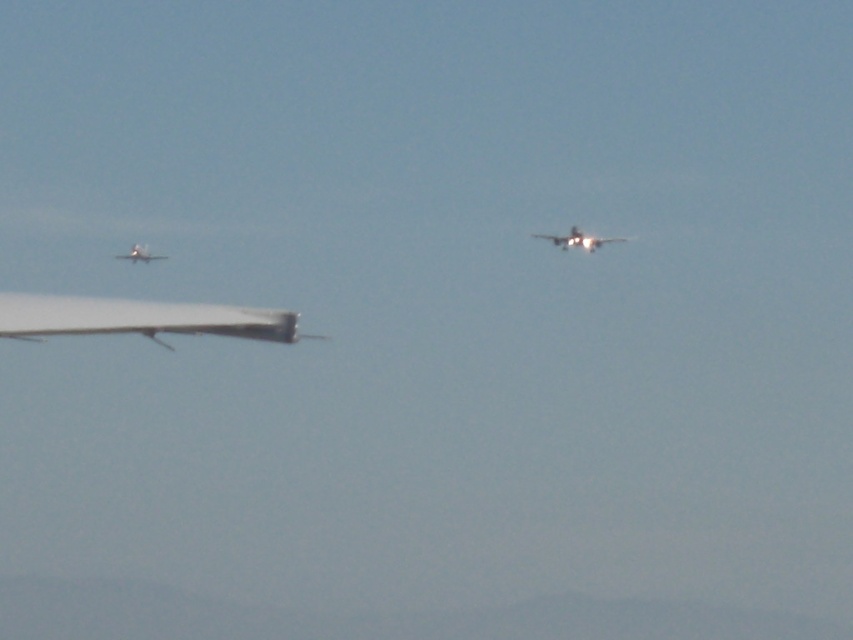
Question: Can you confirm if shiny silver airplane at center is positioned below metallic silver airplane at left?

Choices:
 (A) yes
 (B) no

Answer: (B)

Question: Estimate the real-world distances between objects in this image. Which object is farther from the white matte airplane at left?

Choices:
 (A) metallic silver airplane at left
 (B) shiny silver airplane at center

Answer: (B)

Question: Which of the following is the farthest from the observer?

Choices:
 (A) [x=573, y=241]
 (B) [x=155, y=253]

Answer: (B)

Question: Based on their relative distances, which object is nearer to the white matte airplane at left?

Choices:
 (A) metallic silver airplane at left
 (B) shiny silver airplane at center

Answer: (A)

Question: Can you confirm if white matte airplane at left is smaller than shiny silver airplane at center?

Choices:
 (A) no
 (B) yes

Answer: (B)

Question: Is white matte airplane at left closer to camera compared to shiny silver airplane at center?

Choices:
 (A) no
 (B) yes

Answer: (B)